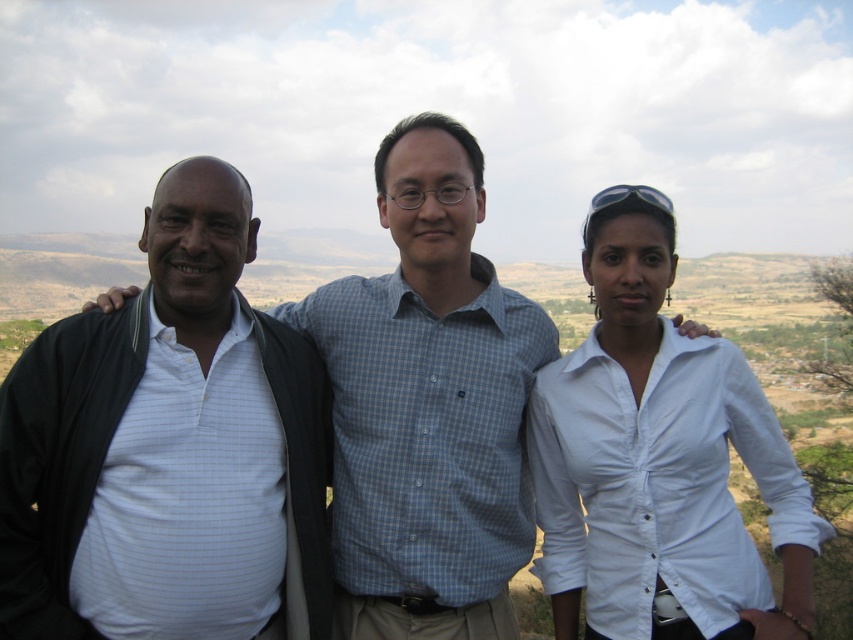
Between point (686, 328) and point (32, 422), which one is positioned in front?

Point (32, 422)

Is point (436, 163) positioned before point (314, 540)?

No, it is not.

Which is in front, point (508, 627) or point (293, 352)?

Point (508, 627) is more forward.

Identify the location of white shirt at center. (427, 403).

Does white shirt at center appear over white button-down shirt at center?

Yes, white shirt at center is above white button-down shirt at center.

Is point (544, 348) more distant than point (704, 602)?

Yes.

The image size is (853, 640). I want to click on white shirt at center, so click(427, 403).

Consider the image. Can you confirm if white button-down shirt at center is positioned to the left of white striped shirt at left?

No, white button-down shirt at center is not to the left of white striped shirt at left.

Can you confirm if white button-down shirt at center is wider than white striped shirt at left?

Yes, white button-down shirt at center is wider than white striped shirt at left.

Where is `white button-down shirt at center`? The image size is (853, 640). white button-down shirt at center is located at coordinates (659, 460).